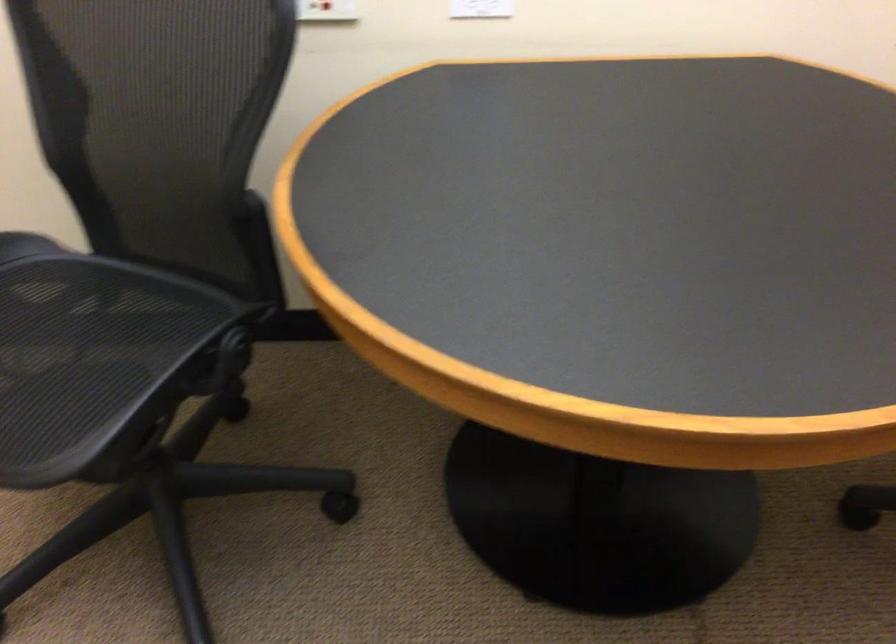
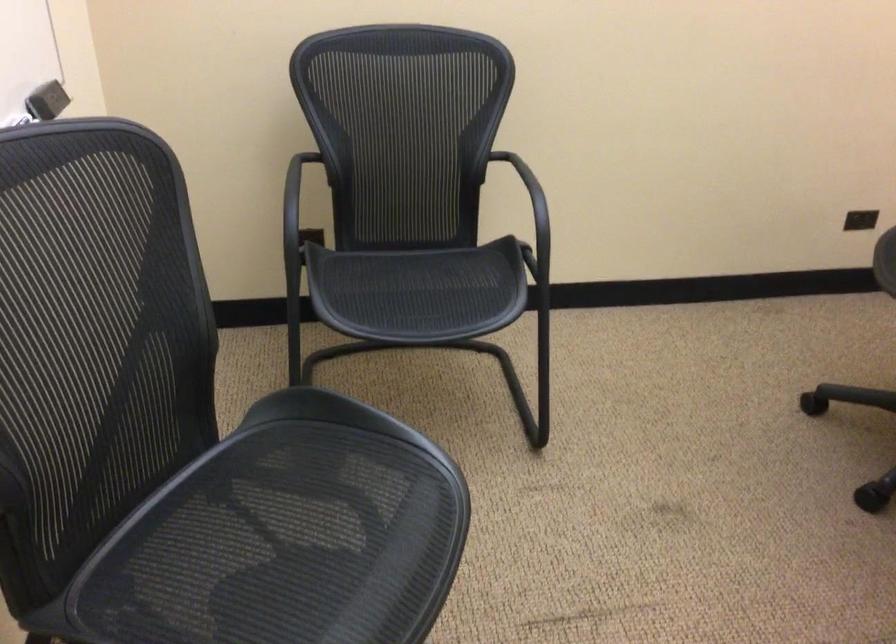
Based on the continuous images, in which direction is the camera rotating?

The camera rotated toward left-down.